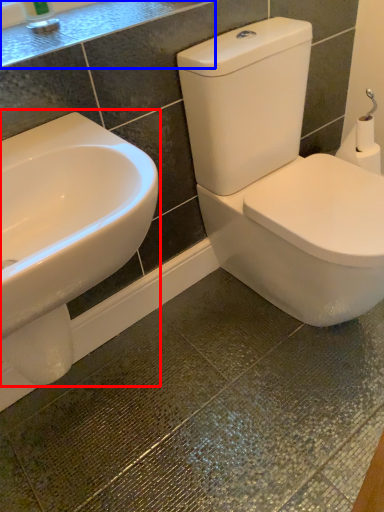
Question: Among these objects, which one is farthest to the camera, sink (highlighted by a red box) or counter top (highlighted by a blue box)?

Choices:
 (A) sink
 (B) counter top

Answer: (B)